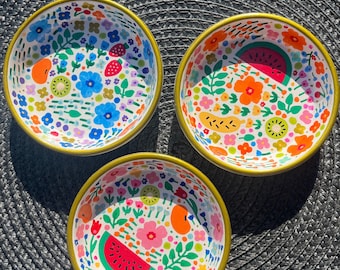
The image size is (340, 270). I want to click on placemat, so click(x=287, y=206).